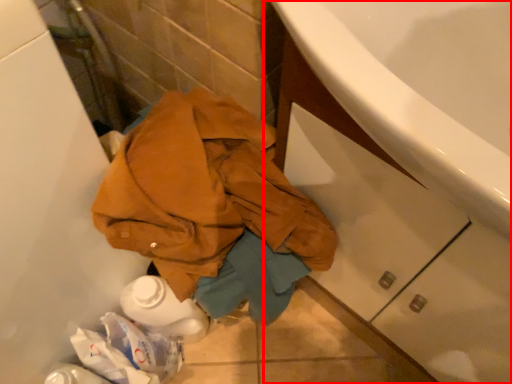
Question: Considering the relative positions of bathroom cabinet (annotated by the red box) and clothing in the image provided, where is bathroom cabinet (annotated by the red box) located with respect to the staircase?

Choices:
 (A) left
 (B) right

Answer: (B)